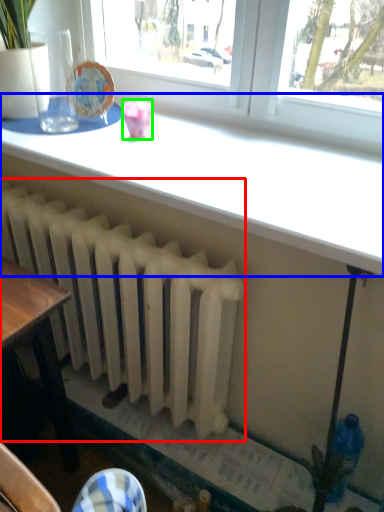
Question: Estimate the real-world distances between objects in this image. Which object is closer to radiator (highlighted by a red box), table (highlighted by a blue box) or tableware (highlighted by a green box)?

Choices:
 (A) table
 (B) tableware

Answer: (A)